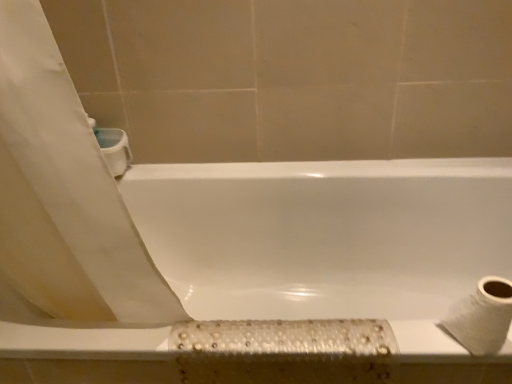
At what (x,y) coordinates should I click in order to perform the action: click on vacant area situated to the left side of white textured toilet paper at lower right. Please return your answer as a coordinate pair (x, y). Image resolution: width=512 pixels, height=384 pixels. Looking at the image, I should click on (381, 339).